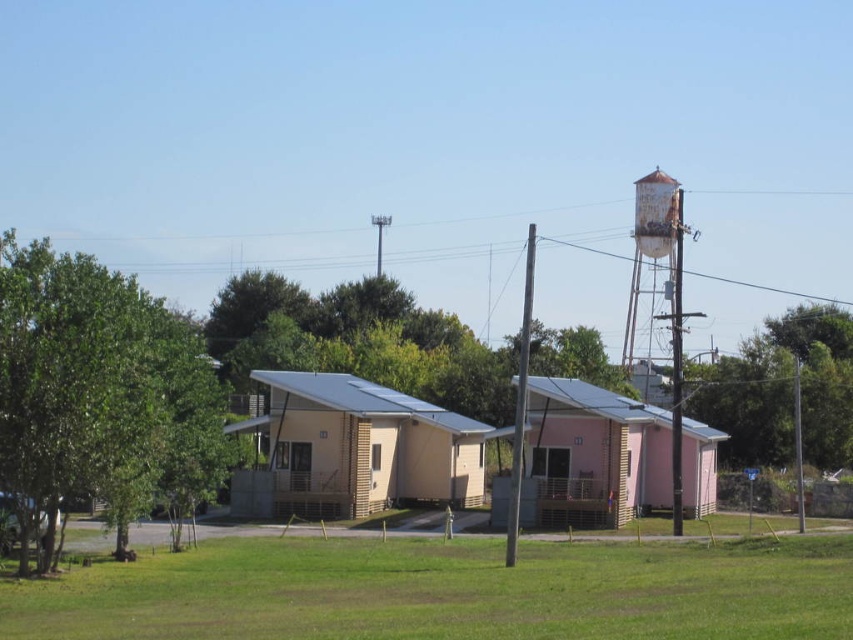
Does green leafy tree at right appear on the left side of rusty metal water tower at upper right?

In fact, green leafy tree at right is to the right of rusty metal water tower at upper right.

Identify the location of green leafy tree at right. This screenshot has width=853, height=640. (780, 392).

In order to click on green leafy tree at right in this screenshot , I will do `click(780, 392)`.

Between green leafy tree at left and beige wood cabin at center, which one appears on the left side from the viewer's perspective?

green leafy tree at left is more to the left.

Looking at this image, which is above, green leafy tree at left or beige wood cabin at center?

green leafy tree at left is above.

Is point (178, 358) positioned behind point (335, 508)?

That is False.

Identify the location of green leafy tree at left. Image resolution: width=853 pixels, height=640 pixels. (100, 397).

Can you confirm if beige wood cabin at center is positioned below green leafy tree at right?

A: Correct, beige wood cabin at center is located below green leafy tree at right.

How distant is beige wood cabin at center from green leafy tree at right?

beige wood cabin at center is 57.59 feet from green leafy tree at right.

Who is more forward, (392, 481) or (761, 339)?

Point (392, 481) is more forward.

Locate an element on the screen. The height and width of the screenshot is (640, 853). beige wood cabin at center is located at coordinates (357, 449).